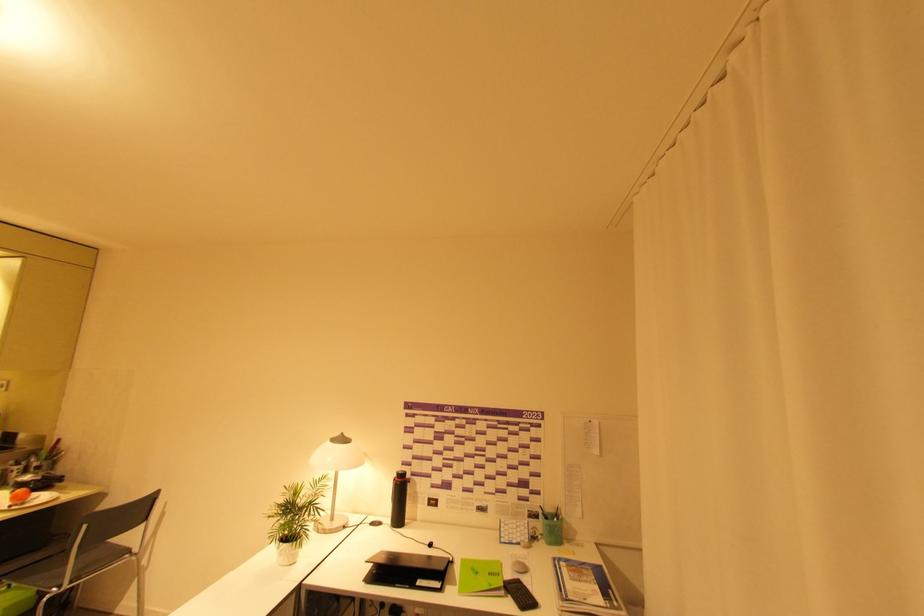
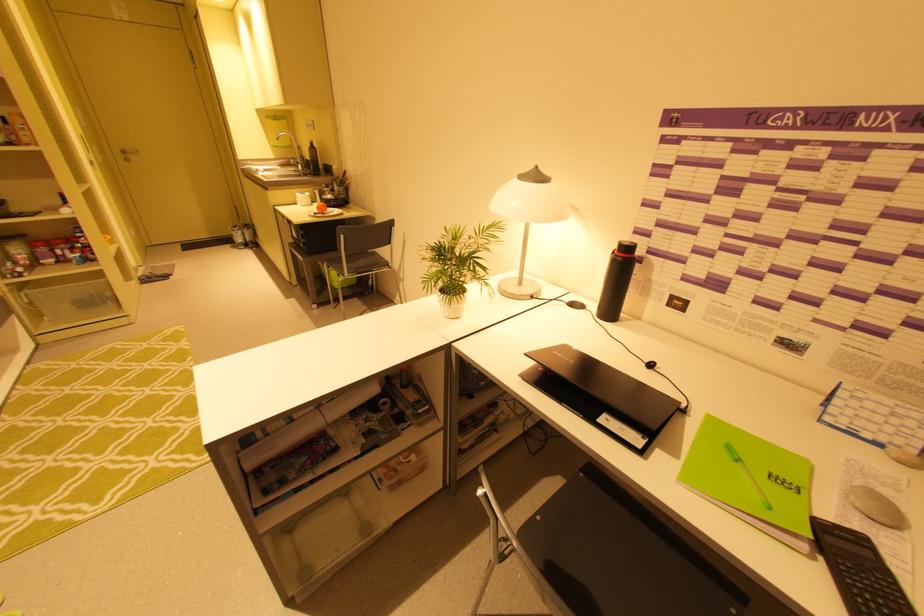
In the second image, find the point that corresponds to pixel 399 476 in the first image.

(619, 248)